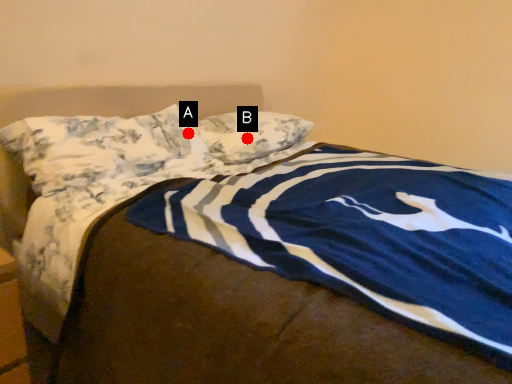
Question: Two points are circled on the image, labeled by A and B beside each circle. Which of the following is the closest to the observer?

Choices:
 (A) A is closer
 (B) B is closer

Answer: (A)